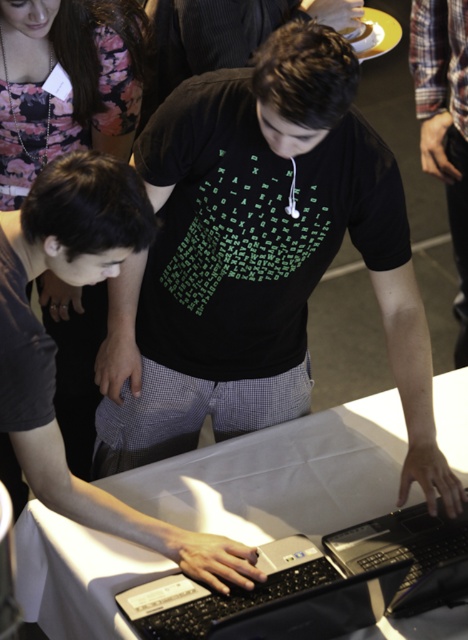
Locate an element on the screen. This screenshot has width=468, height=640. white cloth table at center is located at coordinates (280, 476).

Can you confirm if white cloth table at center is positioned to the left of black matte shirt at center?

In fact, white cloth table at center is to the right of black matte shirt at center.

Between point (85, 637) and point (44, 465), which one is positioned in front?

Positioned in front is point (44, 465).

This screenshot has height=640, width=468. What are the coordinates of `white cloth table at center` in the screenshot? It's located at (280, 476).

Looking at this image, who is taller, black matte t-shirt at center or white cloth table at center?

black matte t-shirt at center is taller.

The width and height of the screenshot is (468, 640). I want to click on black matte t-shirt at center, so click(257, 260).

Is point (160, 417) in front of point (192, 497)?

No, it is not.

I want to click on black matte t-shirt at center, so [x=257, y=260].

The image size is (468, 640). Describe the element at coordinates (70, 83) in the screenshot. I see `black matte shirt at upper left` at that location.

Does point (14, 138) come in front of point (5, 369)?

That is False.

Locate an element on the screen. black matte shirt at upper left is located at coordinates (70, 83).